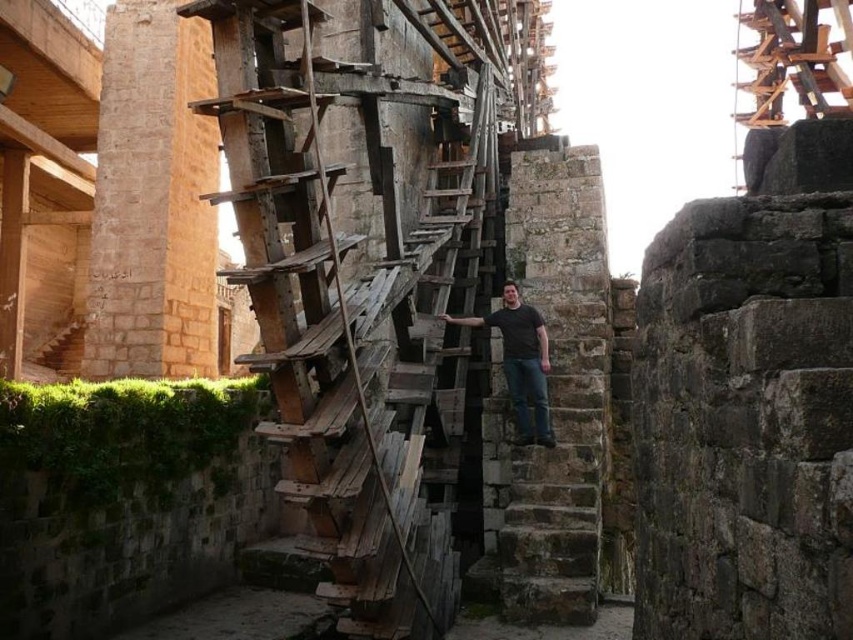
Based on the photo, between weathered wood stairs at center and dark gray t-shirt at center, which one is positioned higher?

weathered wood stairs at center

Based on the photo, does weathered wood stairs at center lie in front of dark gray t-shirt at center?

That is True.

Who is more forward, (x=193, y=12) or (x=520, y=410)?

Point (x=193, y=12) is more forward.

Locate an element on the screen. This screenshot has height=640, width=853. weathered wood stairs at center is located at coordinates coord(363,268).